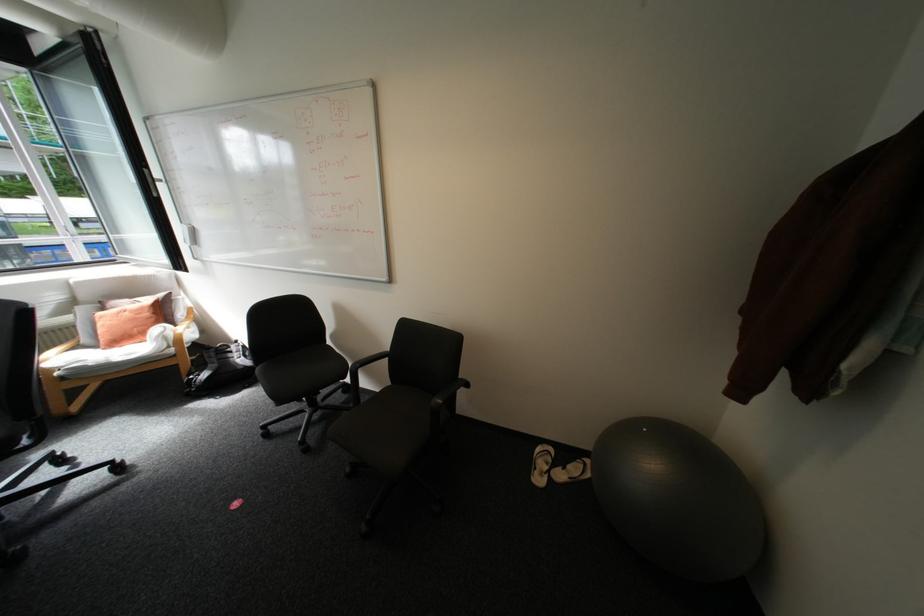
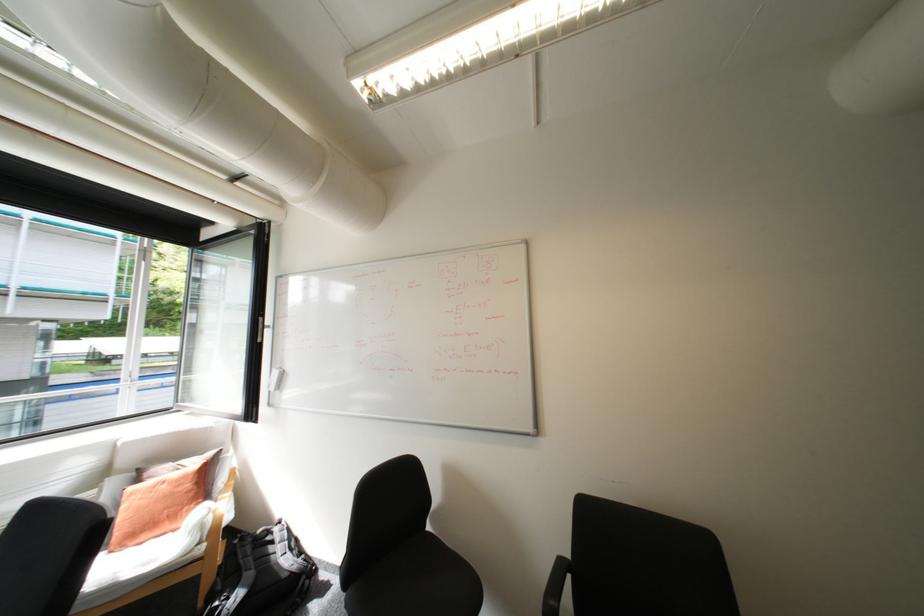
The point at (x=137, y=313) is marked in the first image. Where is the corresponding point in the second image?

(175, 485)